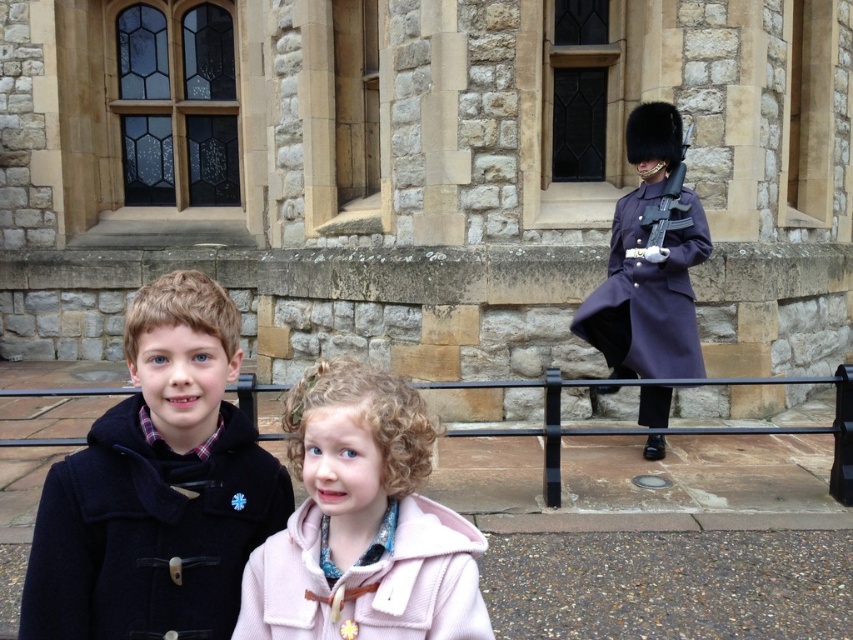
Question: Observing the image, what is the correct spatial positioning of purple woolen coat at right in reference to black metal balustrade at lower center?

Choices:
 (A) below
 (B) above

Answer: (B)

Question: Is dark blue wool coat at center to the left of pink woolen coat at lower center from the viewer's perspective?

Choices:
 (A) no
 (B) yes

Answer: (B)

Question: Which point is closer to the camera taking this photo?

Choices:
 (A) (x=473, y=388)
 (B) (x=650, y=124)

Answer: (A)

Question: Among these objects, which one is farthest from the camera?

Choices:
 (A) dark blue wool coat at center
 (B) pink woolen coat at lower center
 (C) black metal balustrade at lower center

Answer: (C)

Question: Does dark blue wool coat at center have a greater width compared to black metal balustrade at lower center?

Choices:
 (A) no
 (B) yes

Answer: (B)

Question: Among these points, which one is nearest to the camera?

Choices:
 (A) (279, 518)
 (B) (683, 195)

Answer: (A)